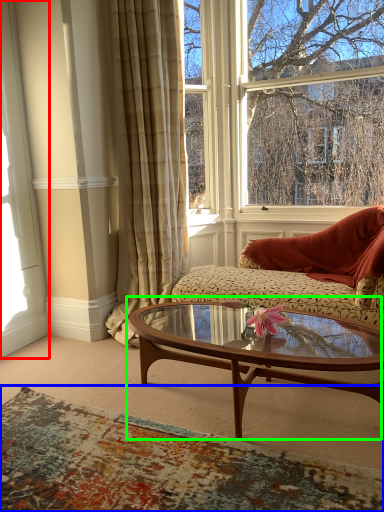
Question: Based on their relative distances, which object is nearer to window frame (highlighted by a red box)? Choose from plain (highlighted by a blue box) and coffee table (highlighted by a green box).

Choices:
 (A) plain
 (B) coffee table

Answer: (A)